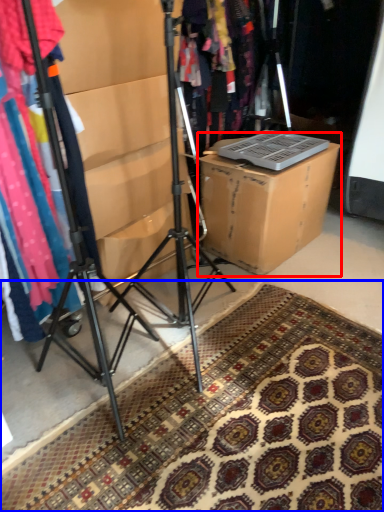
Question: Which point is closer to the camera, cardboard box (highlighted by a red box) or doormat (highlighted by a blue box)?

Choices:
 (A) cardboard box
 (B) doormat

Answer: (B)